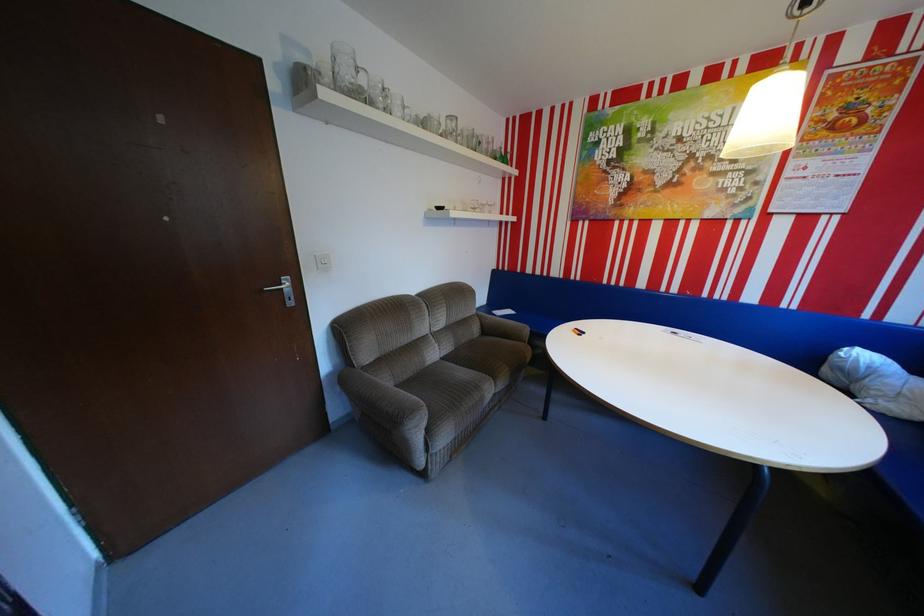
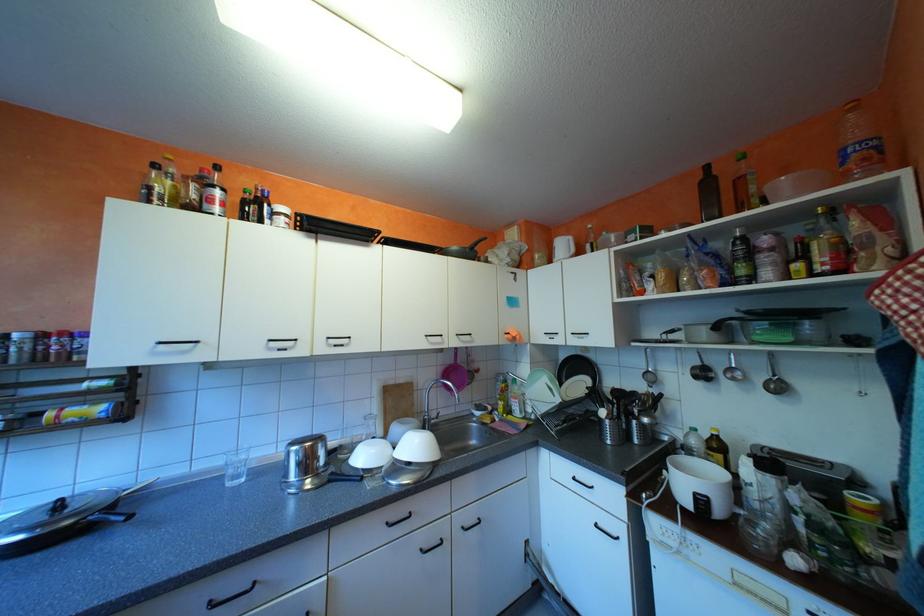
Question: How did the camera likely rotate?

Choices:
 (A) Left
 (B) Right
 (C) Up
 (D) Down

Answer: (A)